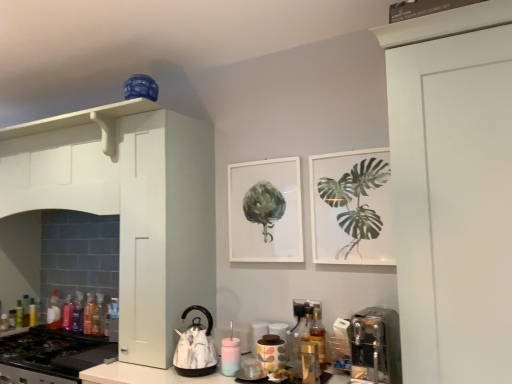
Question: Can you confirm if green leafy plant at upper right is smaller than white glossy kettle at lower center, which is the 1th appliance in left-to-right order?

Choices:
 (A) yes
 (B) no

Answer: (A)

Question: Is green leafy plant at upper right not within white glossy kettle at lower center, the third appliance from the right?

Choices:
 (A) yes
 (B) no

Answer: (A)

Question: Is green leafy plant at upper right oriented away from white glossy kettle at lower center, the third appliance from the right?

Choices:
 (A) no
 (B) yes

Answer: (A)

Question: Would you consider green leafy plant at upper right to be distant from white glossy kettle at lower center, which is the 1th appliance in left-to-right order?

Choices:
 (A) yes
 (B) no

Answer: (B)

Question: Is green leafy plant at upper right thinner than white glossy kettle at lower center, which is the 1th appliance in left-to-right order?

Choices:
 (A) no
 (B) yes

Answer: (B)

Question: From the image's perspective, is translucent plastic bottle at lower left, the eighth bottle positioned from the back, positioned above or below translucent plastic bottle at lower left, the seventh bottle when ordered from back to front?

Choices:
 (A) below
 (B) above

Answer: (B)

Question: Is point (96, 306) positioned closer to the camera than point (89, 316)?

Choices:
 (A) farther
 (B) closer

Answer: (B)

Question: From a real-world perspective, is translucent plastic bottle at lower left, acting as the 8th bottle starting from the left, above or below translucent plastic bottle at lower left, the 3th bottle from the front?

Choices:
 (A) above
 (B) below

Answer: (B)

Question: Is translucent plastic bottle at lower left, acting as the 8th bottle starting from the left, in front of or behind translucent plastic bottle at lower left, the seventh bottle when ordered from back to front, in the image?

Choices:
 (A) front
 (B) behind

Answer: (A)

Question: Is translucent plastic bottle at lower left, the 2th bottle when ordered from right to left, taller or shorter than white matte cabinet at left?

Choices:
 (A) tall
 (B) short

Answer: (B)

Question: Considering the positions of translucent plastic bottle at lower left, acting as the 8th bottle starting from the left, and white matte cabinet at left in the image, is translucent plastic bottle at lower left, acting as the 8th bottle starting from the left, wider or thinner than white matte cabinet at left?

Choices:
 (A) thin
 (B) wide

Answer: (A)

Question: From a real-world perspective, is translucent plastic bottle at lower left, acting as the 8th bottle starting from the left, above or below white matte cabinet at left?

Choices:
 (A) above
 (B) below

Answer: (B)

Question: Is translucent plastic bottle at lower left, which is the second bottle from front to back, to the left or to the right of white matte cabinet at left in the image?

Choices:
 (A) left
 (B) right

Answer: (A)

Question: Does point (373, 309) appear closer or farther from the camera than point (156, 321)?

Choices:
 (A) farther
 (B) closer

Answer: (B)

Question: Is satin silver coffee machine at lower right taller or shorter than white matte cabinet at left?

Choices:
 (A) short
 (B) tall

Answer: (A)